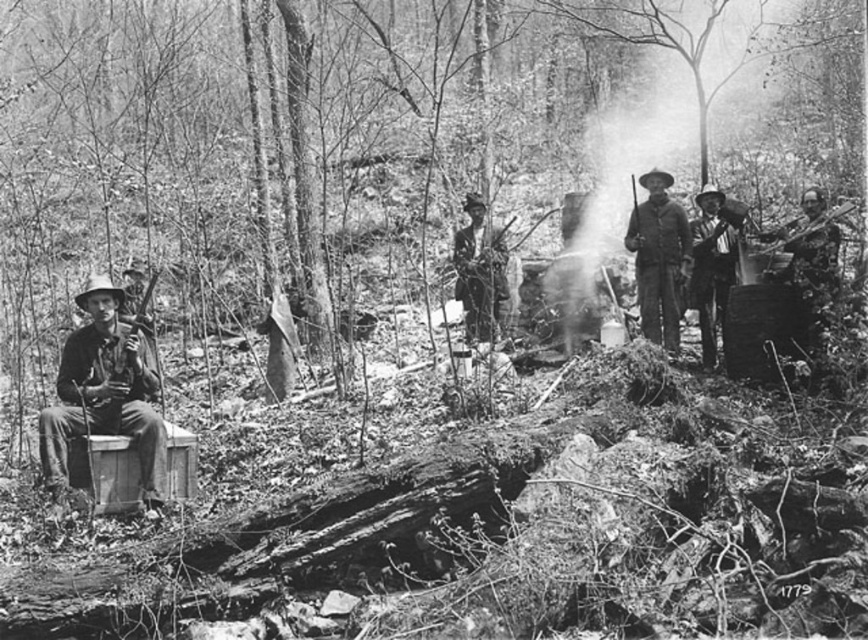
Can you confirm if smooth leather hat at center is positioned to the left of rusty metal rifle at center?

Incorrect, smooth leather hat at center is not on the left side of rusty metal rifle at center.

Can you confirm if smooth leather hat at center is positioned to the right of rusty metal rifle at center?

Indeed, smooth leather hat at center is positioned on the right side of rusty metal rifle at center.

Identify the location of smooth leather hat at center. The width and height of the screenshot is (868, 640). click(713, 260).

Image resolution: width=868 pixels, height=640 pixels. Describe the element at coordinates (659, 259) in the screenshot. I see `rugged leather jacket at center` at that location.

Can you confirm if rugged leather jacket at center is bigger than rusty metal rifle at center?

No.

Where is `rugged leather jacket at center`? The image size is (868, 640). rugged leather jacket at center is located at coordinates (659, 259).

Who is positioned more to the right, matte wooden bucket at left or rusty metal rifle at center?

From the viewer's perspective, rusty metal rifle at center appears more on the right side.

Does point (67, 349) come closer to viewer compared to point (464, 237)?

Yes, it is.

Image resolution: width=868 pixels, height=640 pixels. I want to click on matte wooden bucket at left, so click(104, 396).